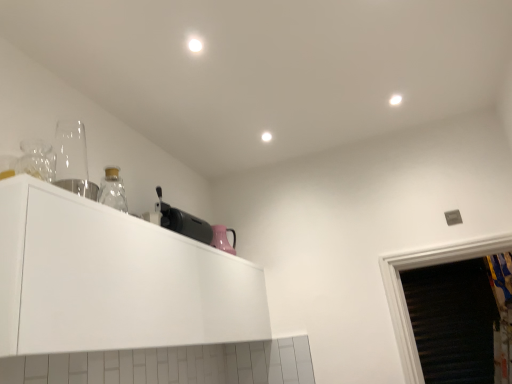
Question: Is black plastic toaster at upper center, which is the 2th appliance in front-to-back order, in contact with white glossy cabinet at upper left?

Choices:
 (A) yes
 (B) no

Answer: (B)

Question: Is black plastic toaster at upper center, placed as the 1th appliance when sorted from bottom to top, behind white glossy cabinet at upper left?

Choices:
 (A) no
 (B) yes

Answer: (B)

Question: Is black plastic toaster at upper center, placed as the 1th appliance when sorted from bottom to top, closer to the viewer compared to white glossy cabinet at upper left?

Choices:
 (A) no
 (B) yes

Answer: (A)

Question: Considering the relative positions of black plastic toaster at upper center, positioned as the 1th appliance in back-to-front order, and white glossy cabinet at upper left in the image provided, is black plastic toaster at upper center, positioned as the 1th appliance in back-to-front order, to the right of white glossy cabinet at upper left from the viewer's perspective?

Choices:
 (A) yes
 (B) no

Answer: (A)

Question: Is black plastic toaster at upper center, which is the 2th appliance in front-to-back order, oriented towards white glossy cabinet at upper left?

Choices:
 (A) no
 (B) yes

Answer: (A)

Question: From a real-world perspective, is black plastic toaster at upper center, the 2th appliance in the left-to-right sequence, positioned over white glossy cabinet at upper left based on gravity?

Choices:
 (A) yes
 (B) no

Answer: (A)

Question: Does white glossy cabinet at upper left lie behind black plastic toaster at upper center, which is the 2th appliance in front-to-back order?

Choices:
 (A) yes
 (B) no

Answer: (B)

Question: Is white glossy cabinet at upper left to the right of black plastic toaster at upper center, which is the 2th appliance in front-to-back order, from the viewer's perspective?

Choices:
 (A) yes
 (B) no

Answer: (B)

Question: From a real-world perspective, is white glossy cabinet at upper left physically above black plastic toaster at upper center, the 2th appliance in the left-to-right sequence?

Choices:
 (A) yes
 (B) no

Answer: (B)

Question: From the image's perspective, is white glossy cabinet at upper left under black plastic toaster at upper center, which is counted as the 2th appliance, starting from the top?

Choices:
 (A) no
 (B) yes

Answer: (B)

Question: From the image's perspective, is white glossy cabinet at upper left on black plastic toaster at upper center, which is the 2th appliance in front-to-back order?

Choices:
 (A) no
 (B) yes

Answer: (A)

Question: Is white glossy cabinet at upper left closer to camera compared to black plastic toaster at upper center, which is counted as the 2th appliance, starting from the top?

Choices:
 (A) no
 (B) yes

Answer: (B)

Question: Considering the relative sizes of transparent glass at left, the first appliance in the left-to-right sequence, and black plastic toaster at upper center, which is the 2th appliance in front-to-back order, in the image provided, is transparent glass at left, the first appliance in the left-to-right sequence, wider than black plastic toaster at upper center, which is the 2th appliance in front-to-back order,?

Choices:
 (A) yes
 (B) no

Answer: (A)